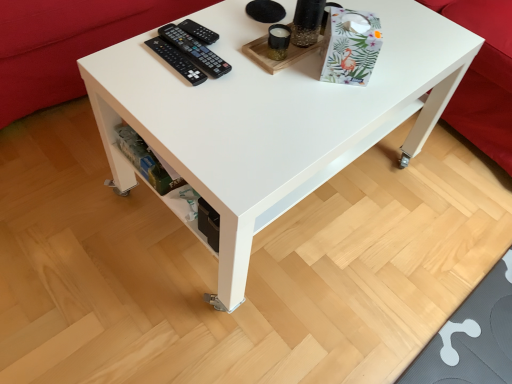
Find the location of a particular element. The height and width of the screenshot is (384, 512). free point in front of black plastic remote at upper center, which ranks as the second control in bottom-to-top order is located at coordinates (186, 74).